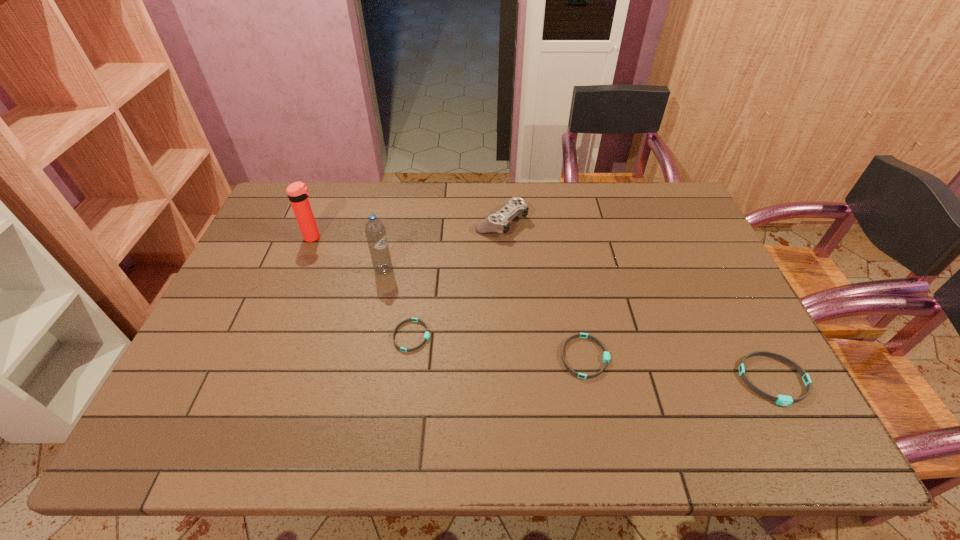
In the image, there is a desktop. In order to click on vacant space at the far edge in this screenshot , I will do `click(609, 191)`.

What are the coordinates of `free location at the near edge` in the screenshot? It's located at (287, 392).

Where is `vacant space at the left edge of the desktop`? The width and height of the screenshot is (960, 540). vacant space at the left edge of the desktop is located at coordinates (289, 254).

Find the location of a particular element. Image resolution: width=960 pixels, height=540 pixels. vacant position at the right edge of the desktop is located at coordinates (666, 259).

Locate an element on the screen. free region at the near left corner is located at coordinates (253, 374).

Where is `unoccupied position between the thermos bottle and the shortest wristband`? The width and height of the screenshot is (960, 540). unoccupied position between the thermos bottle and the shortest wristband is located at coordinates (363, 287).

Where is `free space between the leftmost wristband and the second tallest wristband`? Image resolution: width=960 pixels, height=540 pixels. free space between the leftmost wristband and the second tallest wristband is located at coordinates (498, 347).

At what (x,y) coordinates should I click in order to perform the action: click on free space between the shortest wristband and the control. Please return your answer as a coordinate pair (x, y). Looking at the image, I should click on (457, 279).

At what (x,y) coordinates should I click in order to perform the action: click on empty space between the fifth tallest object and the water bottle. Please return your answer as a coordinate pair (x, y). This screenshot has width=960, height=540. Looking at the image, I should click on (485, 313).

The image size is (960, 540). Identify the location of free spot between the second shortest object and the shortest object. point(498,347).